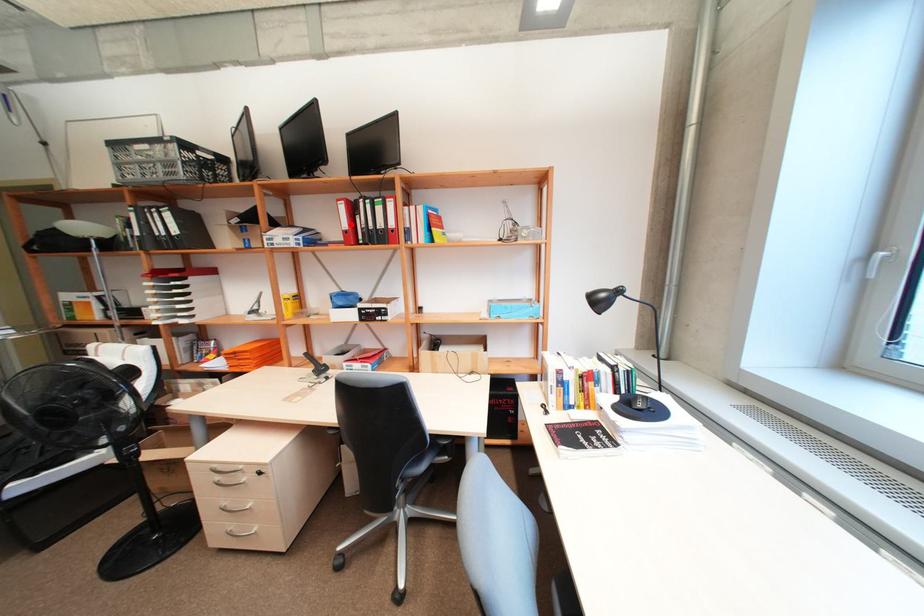
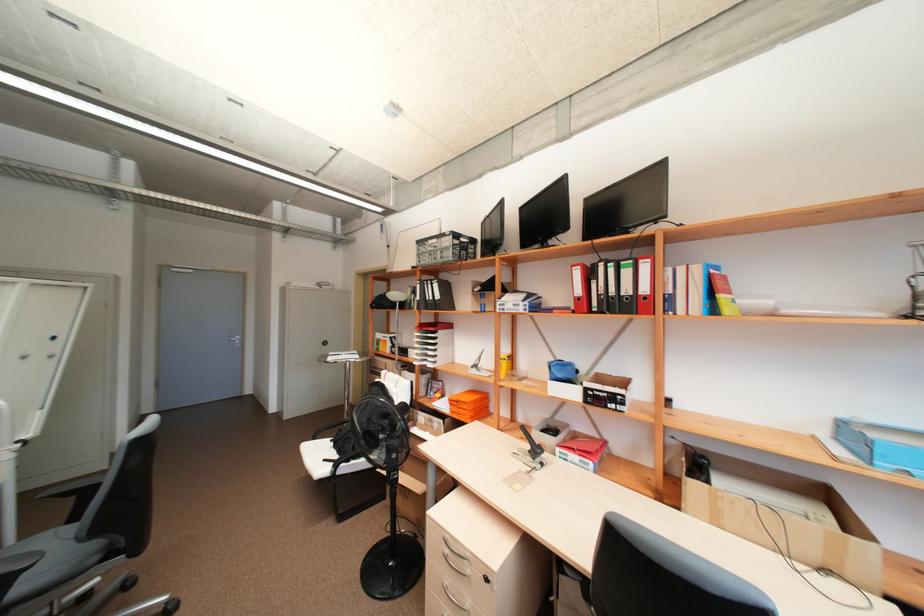
Where in the second image is the point corresponding to the highlighted location from the first image?

(584, 291)